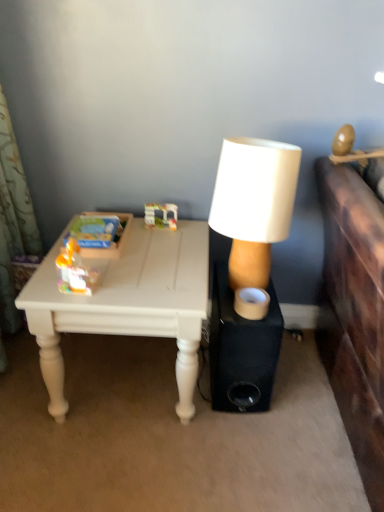
At what (x,y) coordinates should I click in order to perform the action: click on vacant region under white painted wood table at lower left (from a real-world perspective). Please return your answer as a coordinate pair (x, y). Looking at the image, I should click on (126, 380).